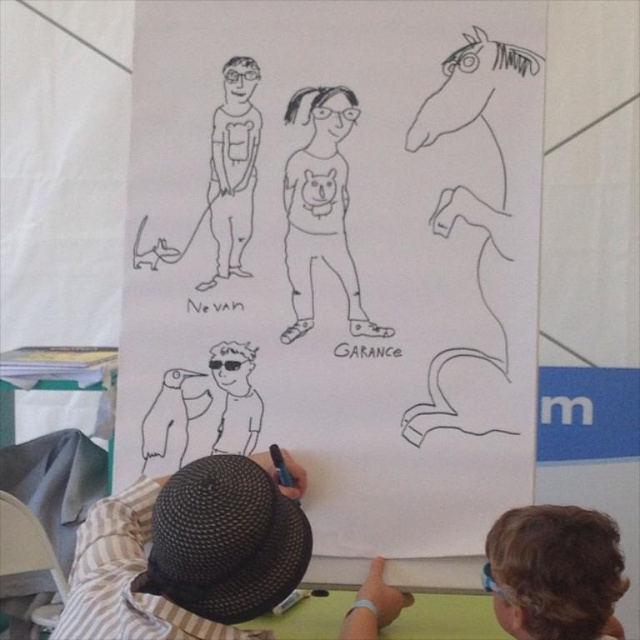
Question: Is brown hair at lower right positioned at the back of black line drawing girl at center?

Choices:
 (A) yes
 (B) no

Answer: (B)

Question: Is brown hair at lower right below black line drawing girl at center?

Choices:
 (A) yes
 (B) no

Answer: (A)

Question: Among these points, which one is farthest from the camera?

Choices:
 (A) (534, 589)
 (B) (317, 113)

Answer: (B)

Question: Does brown hair at lower right have a greater width compared to black line drawing girl at center?

Choices:
 (A) yes
 (B) no

Answer: (A)

Question: Which of the following is the closest to the observer?

Choices:
 (A) (340, 109)
 (B) (563, 580)

Answer: (B)

Question: Which object appears closest to the camera in this image?

Choices:
 (A) black line drawing girl at center
 (B) brown hair at lower right

Answer: (B)